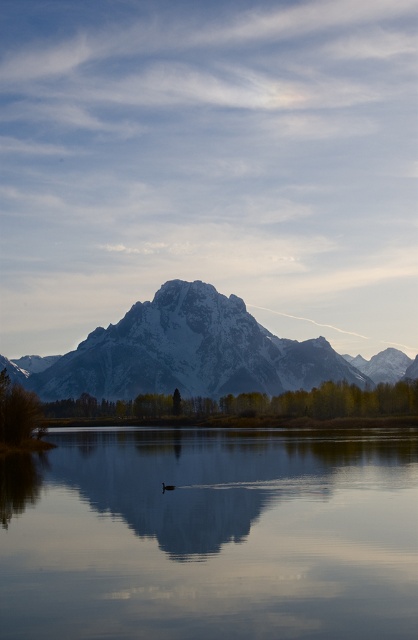
Question: Which of these objects is positioned closest to the brown matte duck at center?

Choices:
 (A) white snow-covered mountain range at center
 (B) smooth glass water at center

Answer: (B)

Question: Does white snow-covered mountain range at center appear on the right side of brown matte duck at center?

Choices:
 (A) no
 (B) yes

Answer: (B)

Question: Can you confirm if white snow-covered mountain range at center is bigger than brown matte duck at center?

Choices:
 (A) yes
 (B) no

Answer: (A)

Question: Which point is closer to the camera taking this photo?

Choices:
 (A) (79, 529)
 (B) (209, 284)
 (C) (170, 490)

Answer: (A)

Question: Among these points, which one is nearest to the camera?

Choices:
 (A) (158, 356)
 (B) (379, 456)
 (C) (163, 486)

Answer: (C)

Question: From the image, what is the correct spatial relationship of white snow-covered mountain range at center in relation to brown matte duck at center?

Choices:
 (A) right
 (B) left

Answer: (A)